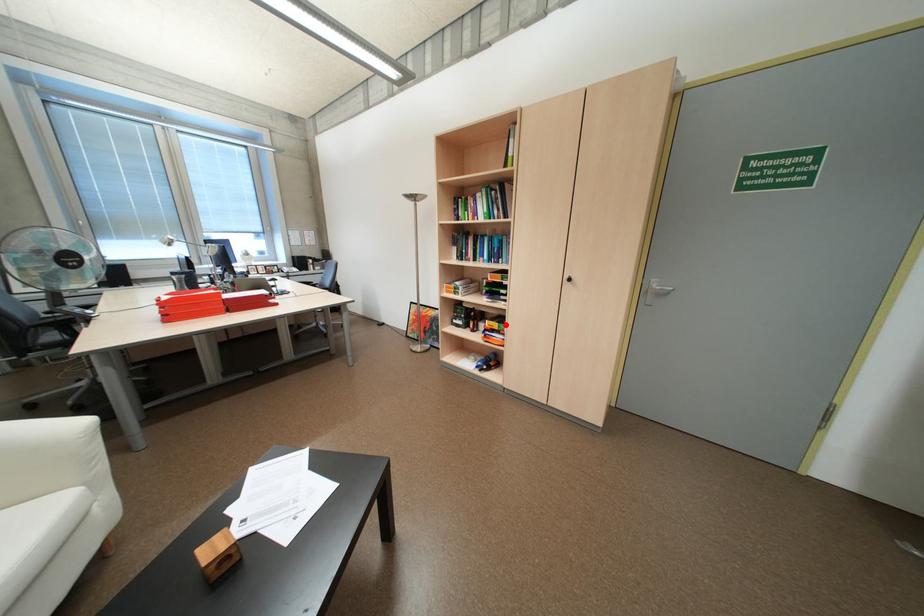
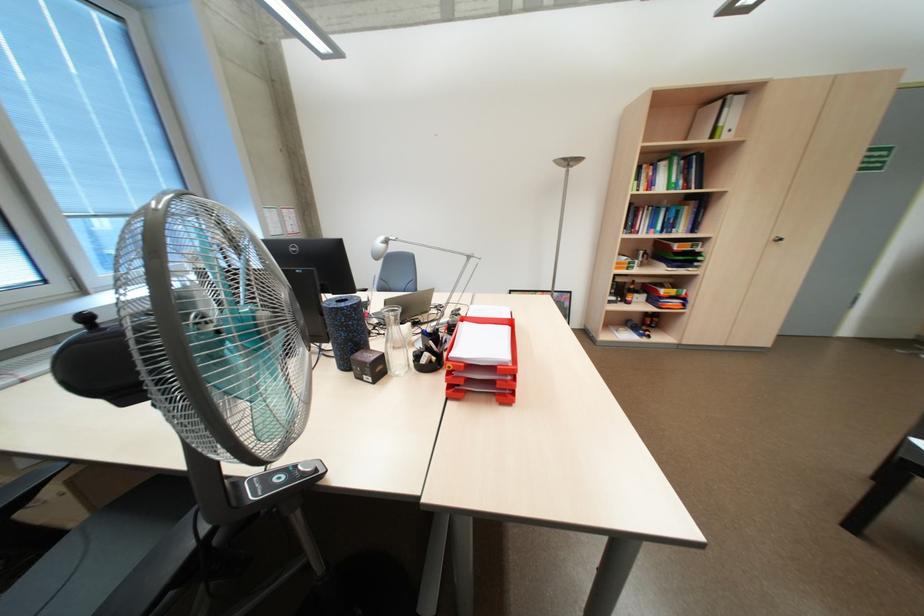
The point at the highlighted location is marked in the first image. Where is the corresponding point in the second image?

(683, 291)